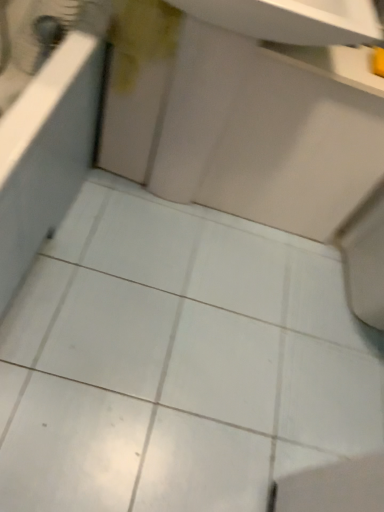
Question: Are white glossy sink at center and white glossy bath at left far apart?

Choices:
 (A) yes
 (B) no

Answer: (B)

Question: Is white glossy sink at center aimed at white glossy bath at left?

Choices:
 (A) yes
 (B) no

Answer: (B)

Question: Is white glossy bath at left a part of white glossy sink at center?

Choices:
 (A) yes
 (B) no

Answer: (B)

Question: Considering the relative positions of white glossy sink at center and white glossy bath at left in the image provided, is white glossy sink at center to the right of white glossy bath at left from the viewer's perspective?

Choices:
 (A) yes
 (B) no

Answer: (A)

Question: Does white glossy sink at center have a greater height compared to white glossy bath at left?

Choices:
 (A) yes
 (B) no

Answer: (A)

Question: Is white glossy sink at center outside white glossy bath at left?

Choices:
 (A) yes
 (B) no

Answer: (A)

Question: Does white glossy bath at left come in front of white glossy sink at center?

Choices:
 (A) no
 (B) yes

Answer: (B)

Question: Are white glossy bath at left and white glossy sink at center far apart?

Choices:
 (A) no
 (B) yes

Answer: (A)

Question: From the image's perspective, is white glossy bath at left located beneath white glossy sink at center?

Choices:
 (A) no
 (B) yes

Answer: (B)

Question: Is white glossy sink at center located within white glossy bath at left?

Choices:
 (A) no
 (B) yes

Answer: (A)

Question: Does white glossy bath at left have a smaller size compared to white glossy sink at center?

Choices:
 (A) yes
 (B) no

Answer: (B)

Question: Considering the relative sizes of white glossy bath at left and white glossy sink at center in the image provided, is white glossy bath at left shorter than white glossy sink at center?

Choices:
 (A) yes
 (B) no

Answer: (A)

Question: Considering the positions of white glossy sink at center and white glossy bath at left in the image, is white glossy sink at center wider or thinner than white glossy bath at left?

Choices:
 (A) wide
 (B) thin

Answer: (B)